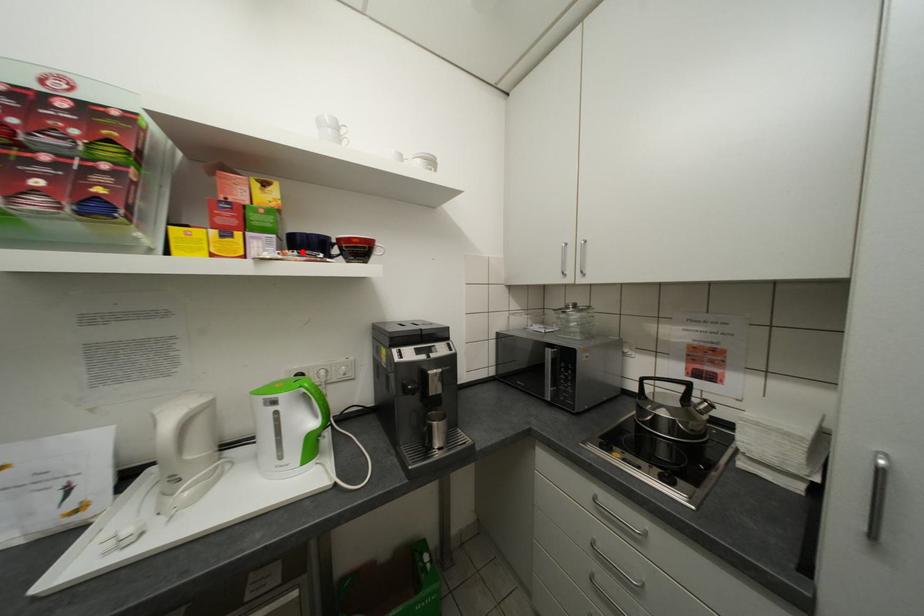
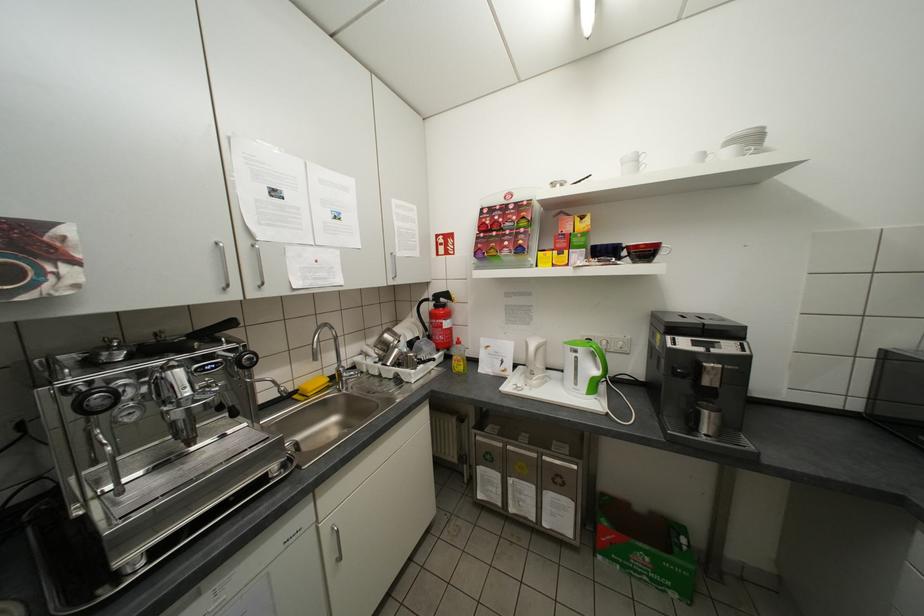
Locate, in the second image, the point that corresponds to the highlighted location in the first image.

(603, 259)